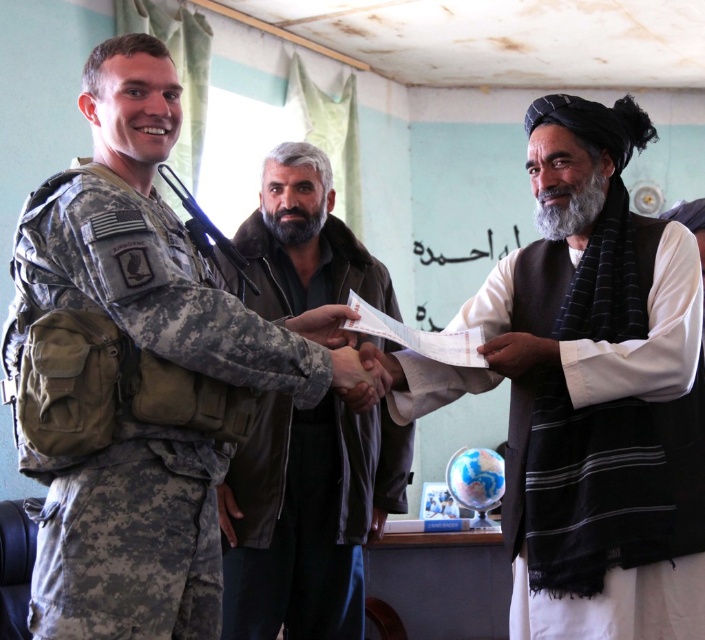
Does camouflage uniform at left have a smaller size compared to white paper at right?

Actually, camouflage uniform at left might be larger than white paper at right.

Does point (183, 595) come behind point (491, 352)?

No, (183, 595) is in front of (491, 352).

This screenshot has width=705, height=640. In order to click on camouflage uniform at left in this screenshot , I will do `click(133, 374)`.

The width and height of the screenshot is (705, 640). Identify the location of camouflage uniform at left. (133, 374).

Which is in front, point (324, 220) or point (553, 353)?

Positioned in front is point (553, 353).

Between point (321, 426) and point (539, 349), which one is positioned behind?

The point (321, 426) is behind.

You are a GUI agent. You are given a task and a screenshot of the screen. Output one action in this format:
    pyautogui.click(x=<x>, y=<y>)
    Task: Click on the dark brown leather jacket at center
    The height and width of the screenshot is (640, 705).
    Given the screenshot: What is the action you would take?
    pyautogui.click(x=307, y=515)

Consider the image. Does white striped vest at center appear under white paper at right?

Incorrect, white striped vest at center is not positioned below white paper at right.

Between white striped vest at center and white paper at right, which one has less height?

white paper at right

Does point (522, 253) come in front of point (494, 365)?

No.

The image size is (705, 640). Find the location of `white striped vest at center`. white striped vest at center is located at coordinates (601, 400).